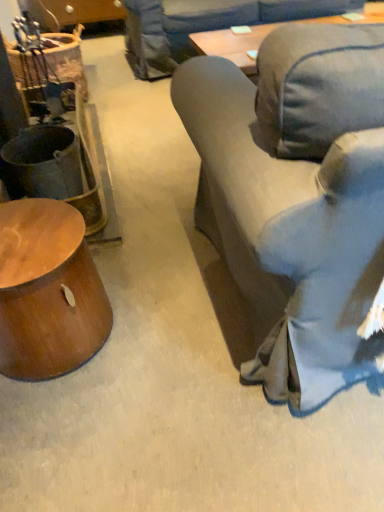
Locate an element on the screen. denim fabric couch at right is located at coordinates (297, 197).

The image size is (384, 512). What do you see at coordinates (297, 197) in the screenshot? I see `denim fabric couch at right` at bounding box center [297, 197].

What is the approximate height of shiny brown wood side table at lower left?

shiny brown wood side table at lower left is 38.88 centimeters tall.

Measure the distance between shiny brown wood side table at lower left and camera.

The depth of shiny brown wood side table at lower left is 37.84 inches.

This screenshot has width=384, height=512. What do you see at coordinates (48, 291) in the screenshot? I see `shiny brown wood side table at lower left` at bounding box center [48, 291].

This screenshot has height=512, width=384. I want to click on shiny brown wood side table at lower left, so click(48, 291).

Locate an element on the screen. This screenshot has width=384, height=512. denim fabric couch at right is located at coordinates pyautogui.click(x=297, y=197).

Can you confirm if denim fabric couch at right is positioned to the left of shiny brown wood side table at lower left?

Incorrect, denim fabric couch at right is not on the left side of shiny brown wood side table at lower left.

Considering their positions, is denim fabric couch at right located in front of or behind shiny brown wood side table at lower left?

denim fabric couch at right is positioned closer to the viewer than shiny brown wood side table at lower left.

Is point (311, 152) closer or farther from the camera than point (65, 208)?

Clearly, point (311, 152) is closer to the camera than point (65, 208).

From the image's perspective, is denim fabric couch at right above shiny brown wood side table at lower left?

Indeed, from the image's perspective, denim fabric couch at right is shown above shiny brown wood side table at lower left.

From a real-world perspective, is denim fabric couch at right positioned above or below shiny brown wood side table at lower left?

In terms of real-world spatial position, denim fabric couch at right is above shiny brown wood side table at lower left.

Between denim fabric couch at right and shiny brown wood side table at lower left, which one has smaller width?

With smaller width is shiny brown wood side table at lower left.

Considering the relative sizes of denim fabric couch at right and shiny brown wood side table at lower left in the image provided, is denim fabric couch at right shorter than shiny brown wood side table at lower left?

In fact, denim fabric couch at right may be taller than shiny brown wood side table at lower left.

Looking at the image, does denim fabric couch at right seem bigger or smaller compared to shiny brown wood side table at lower left?

In the image, denim fabric couch at right appears to be larger than shiny brown wood side table at lower left.

Would you say denim fabric couch at right is inside or outside shiny brown wood side table at lower left?

denim fabric couch at right is spatially situated outside shiny brown wood side table at lower left.

Are denim fabric couch at right and shiny brown wood side table at lower left making contact?

No, denim fabric couch at right is not with shiny brown wood side table at lower left.

Could you tell me if denim fabric couch at right is turned towards shiny brown wood side table at lower left?

No, denim fabric couch at right does not turn towards shiny brown wood side table at lower left.

The width and height of the screenshot is (384, 512). In order to click on table below the denim fabric couch at right (from the image's perspective) in this screenshot , I will do `click(48, 291)`.

Is shiny brown wood side table at lower left to the left or to the right of denim fabric couch at right in the image?

From the image, it's evident that shiny brown wood side table at lower left is to the left of denim fabric couch at right.

Which object is further away from the camera, shiny brown wood side table at lower left or denim fabric couch at right?

Positioned behind is shiny brown wood side table at lower left.

Which is in front, point (7, 301) or point (296, 98)?

The point (296, 98) is closer.

From the image's perspective, is shiny brown wood side table at lower left beneath denim fabric couch at right?

Yes, from the image's perspective, shiny brown wood side table at lower left is below denim fabric couch at right.

From the picture: From a real-world perspective, is shiny brown wood side table at lower left above or below denim fabric couch at right?

Clearly, from a real-world perspective, shiny brown wood side table at lower left is below denim fabric couch at right.

Which object is thinner, shiny brown wood side table at lower left or denim fabric couch at right?

shiny brown wood side table at lower left is thinner.

Can you confirm if shiny brown wood side table at lower left is shorter than denim fabric couch at right?

Yes.

Which of these two, shiny brown wood side table at lower left or denim fabric couch at right, is bigger?

With larger size is denim fabric couch at right.

Is shiny brown wood side table at lower left located outside denim fabric couch at right?

Yes, shiny brown wood side table at lower left is not within denim fabric couch at right.

Are shiny brown wood side table at lower left and denim fabric couch at right located far from each other?

Actually, shiny brown wood side table at lower left and denim fabric couch at right are a little close together.

Could you tell me if shiny brown wood side table at lower left is facing denim fabric couch at right?

Yes, shiny brown wood side table at lower left is facing denim fabric couch at right.

In order to click on studio couch above the shiny brown wood side table at lower left (from the image's perspective) in this screenshot , I will do `click(297, 197)`.

Identify the location of table directly beneath the denim fabric couch at right (from a real-world perspective). The width and height of the screenshot is (384, 512). (48, 291).

The image size is (384, 512). Find the location of `studio couch above the shiny brown wood side table at lower left (from a real-world perspective)`. studio couch above the shiny brown wood side table at lower left (from a real-world perspective) is located at coordinates (297, 197).